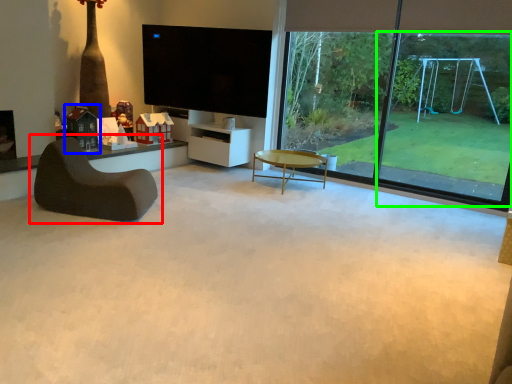
Question: Which object is the farthest from chair (highlighted by a red box)? Choose among these: toy (highlighted by a blue box) or window frame (highlighted by a green box).

Choices:
 (A) toy
 (B) window frame

Answer: (B)